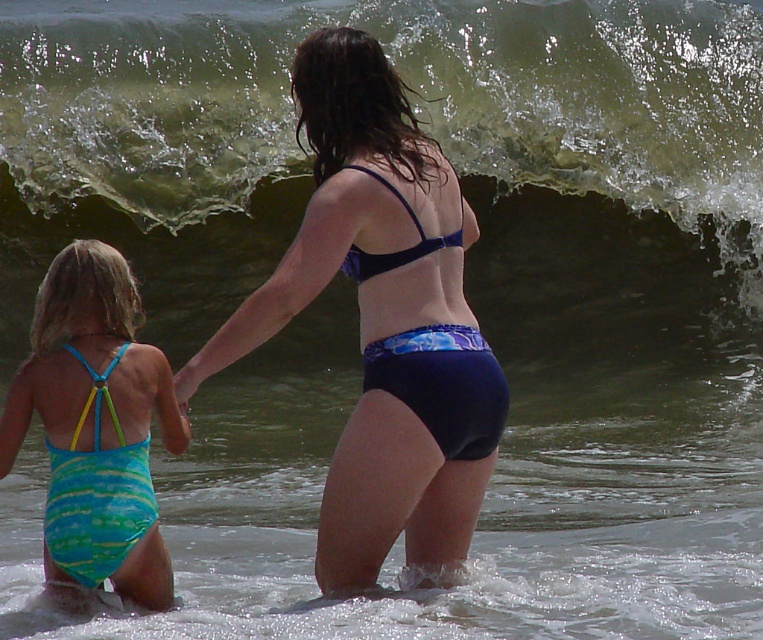
Is blue fabric bikini at center thinner than blue matte bikini bottom at center?

Incorrect, blue fabric bikini at center's width is not less than blue matte bikini bottom at center's.

Does blue fabric bikini at center have a larger size compared to blue matte bikini bottom at center?

Indeed, blue fabric bikini at center has a larger size compared to blue matte bikini bottom at center.

Between point (230, 330) and point (403, 371), which one is positioned in front?

Point (230, 330) is more forward.

What are the coordinates of `blue fabric bikini at center` in the screenshot? It's located at (382, 320).

Which of these two, blue striped swimsuit at lower left or teal striped swimsuit at lower left, stands taller?

blue striped swimsuit at lower left

Is point (52, 541) positioned before point (137, 444)?

Yes, it is.

Is point (29, 374) in front of point (95, 520)?

No, it is behind (95, 520).

Identify the location of blue striped swimsuit at lower left. (95, 426).

Between blue fabric bikini at center and teal striped swimsuit at lower left, which one appears on the right side from the viewer's perspective?

blue fabric bikini at center

Between point (494, 381) and point (105, 545), which one is positioned behind?

The point (494, 381) is more distant.

In order to click on blue fabric bikini at center in this screenshot , I will do `click(382, 320)`.